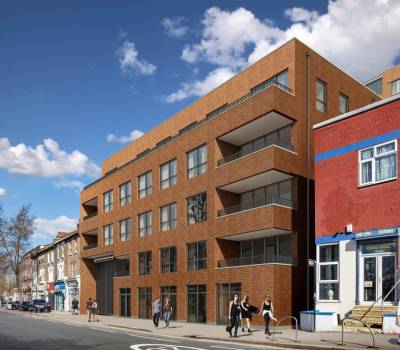
Locate an element on the screen. Image resolution: width=400 pixels, height=350 pixels. windows is located at coordinates (204, 166), (172, 175), (142, 186), (141, 219), (128, 199), (124, 229), (110, 230), (110, 197), (167, 215).